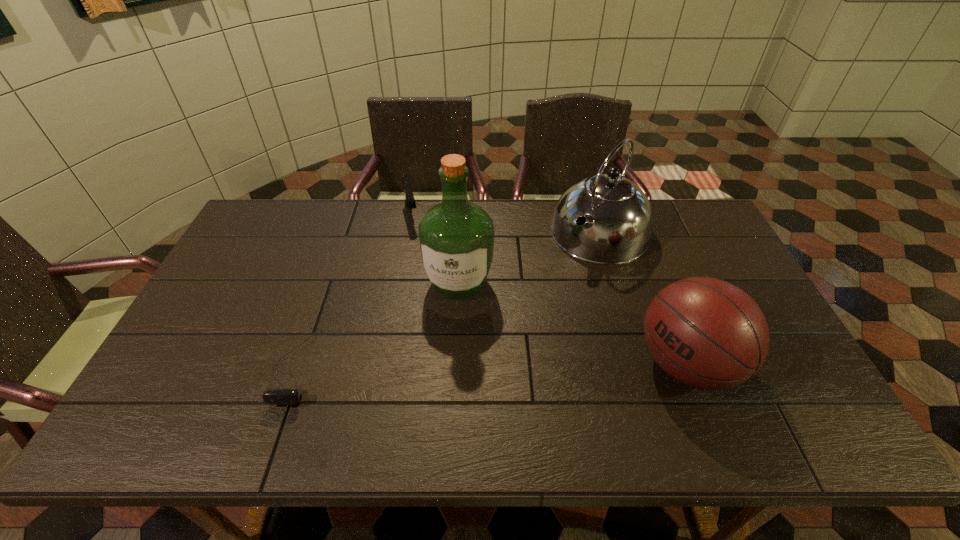
The height and width of the screenshot is (540, 960). In the image, there is a desktop. What are the coordinates of `free space at the near right corner` in the screenshot? It's located at (766, 372).

Locate an element on the screen. The width and height of the screenshot is (960, 540). free space between the kettle and the basketball is located at coordinates (642, 298).

The height and width of the screenshot is (540, 960). I want to click on free space between the tallest object and the shortest object, so click(377, 325).

Where is `empty space that is in between the second tallest object and the tallest object`? empty space that is in between the second tallest object and the tallest object is located at coordinates (529, 258).

Find the location of a particular element. This screenshot has height=540, width=960. free space between the basketball and the kettle is located at coordinates (642, 298).

Where is `free space that is in between the third tallest object and the shortest object`? Image resolution: width=960 pixels, height=540 pixels. free space that is in between the third tallest object and the shortest object is located at coordinates (491, 364).

The height and width of the screenshot is (540, 960). What are the coordinates of `free space between the third object from left to right and the basketball` in the screenshot? It's located at (572, 323).

Locate an element on the screen. free spot between the third shortest object and the third object from left to right is located at coordinates (572, 323).

The image size is (960, 540). Find the location of `free space between the fourth tallest object and the shortest object`. free space between the fourth tallest object and the shortest object is located at coordinates (353, 289).

Identify the location of free space between the third tallest object and the webcam. (491, 364).